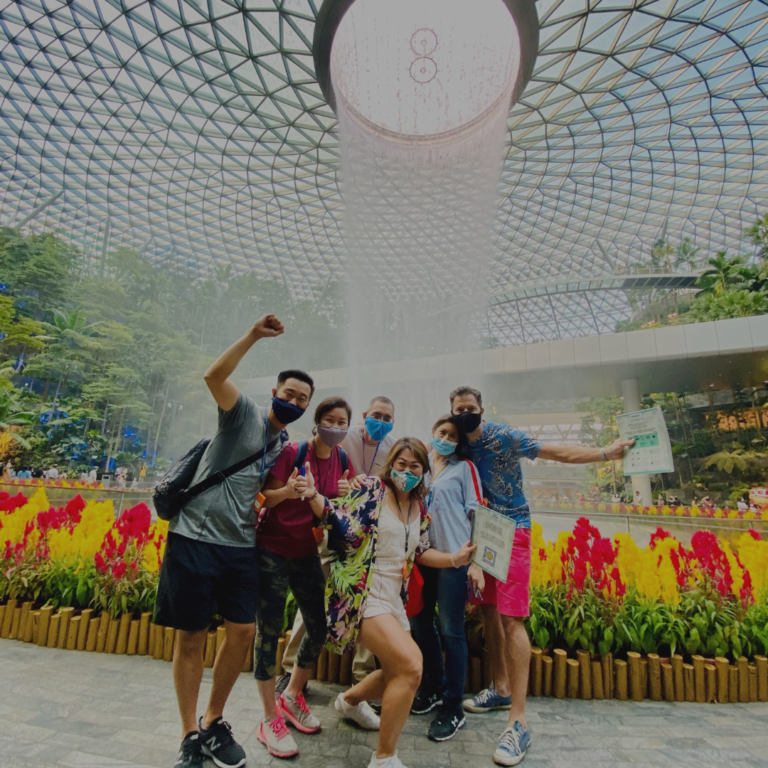
At what (x,y) coordinates should I click in order to perform the action: click on printed document. Please return your answer as a coordinate pair (x, y). Image resolution: width=768 pixels, height=768 pixels. Looking at the image, I should click on (487, 537), (644, 445).